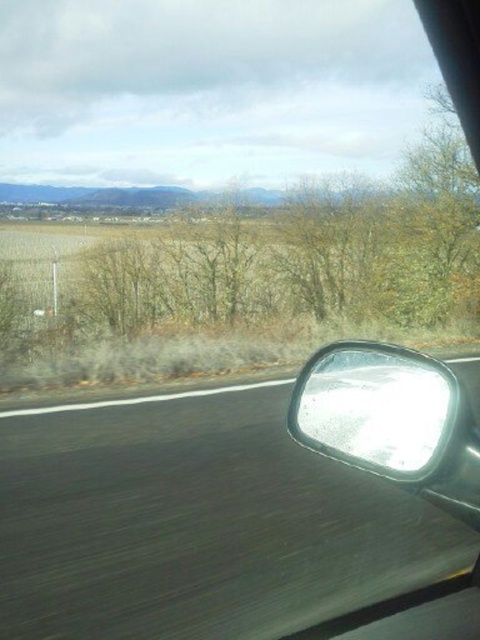
Question: Is brown leafless tree at center closer to camera compared to glossy metallic rearview mirror at lower right?

Choices:
 (A) no
 (B) yes

Answer: (A)

Question: Is brown leafless tree at center wider than glossy metallic rearview mirror at lower right?

Choices:
 (A) no
 (B) yes

Answer: (B)

Question: Which point is farther to the camera?

Choices:
 (A) glossy metallic rearview mirror at lower right
 (B) brown leafless tree at center

Answer: (B)

Question: Does brown leafless tree at center lie in front of glossy metallic rearview mirror at lower right?

Choices:
 (A) no
 (B) yes

Answer: (A)

Question: Which object appears farthest from the camera in this image?

Choices:
 (A) glossy metallic rearview mirror at lower right
 (B) brown leafless tree at center

Answer: (B)